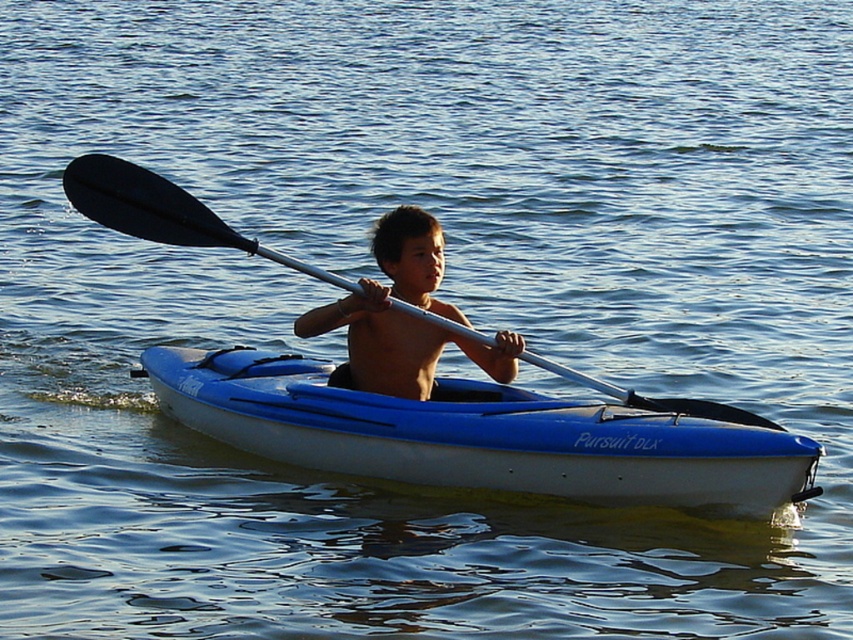
Does blue plastic canoe at center have a smaller size compared to smooth skin boy at center?

No, blue plastic canoe at center is not smaller than smooth skin boy at center.

Is blue plastic canoe at center to the left of smooth skin boy at center from the viewer's perspective?

Incorrect, blue plastic canoe at center is not on the left side of smooth skin boy at center.

Does point (303, 380) come in front of point (508, 369)?

No, (303, 380) is behind (508, 369).

Where is `blue plastic canoe at center`? blue plastic canoe at center is located at coordinates coord(480,436).

In the scene shown: Between blue plastic canoe at center and black rubber paddle at center, which one has less height?

black rubber paddle at center

Identify the location of blue plastic canoe at center. Image resolution: width=853 pixels, height=640 pixels. (480, 436).

Identify the location of blue plastic canoe at center. (480, 436).

Does smooth skin boy at center have a larger size compared to black rubber paddle at center?

Yes.

Based on the photo, does smooth skin boy at center appear under black rubber paddle at center?

Yes, smooth skin boy at center is below black rubber paddle at center.

Which is in front, point (358, 346) or point (654, 403)?

Point (358, 346) is more forward.

What are the coordinates of `smooth skin boy at center` in the screenshot? It's located at (403, 316).